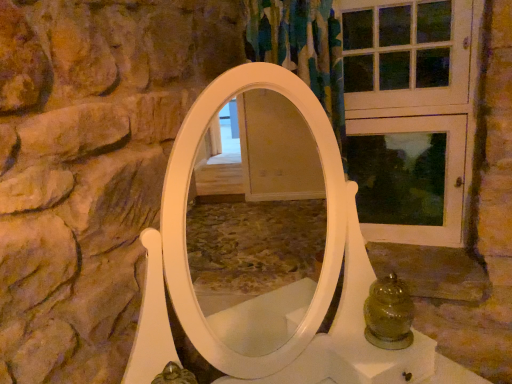
Question: Is white wood screen door at upper right inside the boundaries of green glass jar at lower right, or outside?

Choices:
 (A) inside
 (B) outside

Answer: (B)

Question: From a real-world perspective, is white wood screen door at upper right above or below green glass jar at lower right?

Choices:
 (A) above
 (B) below

Answer: (A)

Question: From the image's perspective, is white wood screen door at upper right positioned above or below green glass jar at lower right?

Choices:
 (A) above
 (B) below

Answer: (A)

Question: From a real-world perspective, relative to white wood screen door at upper right, is green glass jar at lower right vertically above or below?

Choices:
 (A) above
 (B) below

Answer: (B)

Question: Is green glass jar at lower right wider or thinner than white wood screen door at upper right?

Choices:
 (A) thin
 (B) wide

Answer: (B)

Question: Choose the correct answer: Is green glass jar at lower right inside white wood screen door at upper right or outside it?

Choices:
 (A) outside
 (B) inside

Answer: (A)

Question: From their relative heights in the image, would you say green glass jar at lower right is taller or shorter than white wood screen door at upper right?

Choices:
 (A) short
 (B) tall

Answer: (A)